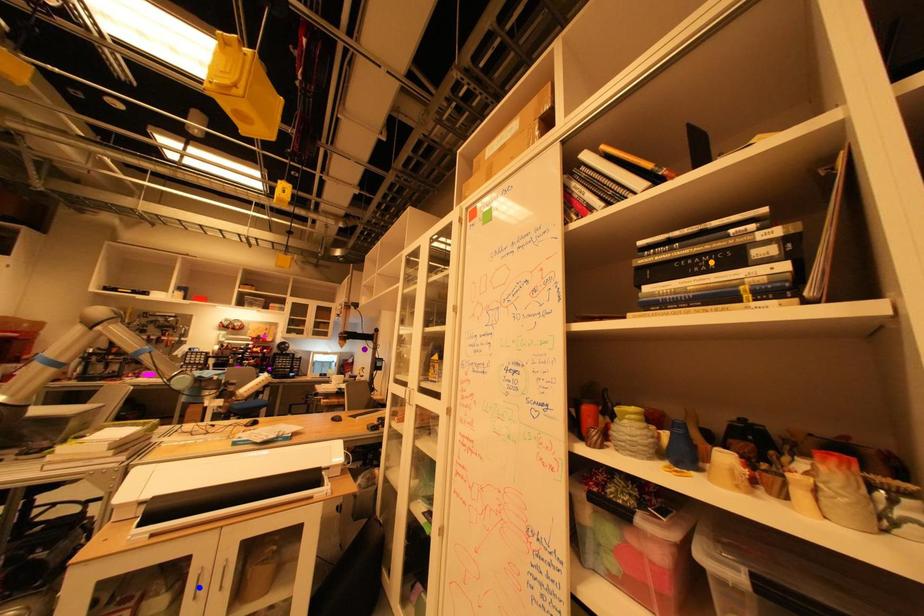
Order these from nearest to farthest:
A) blue point
B) orange point
C) purple point

orange point → blue point → purple point